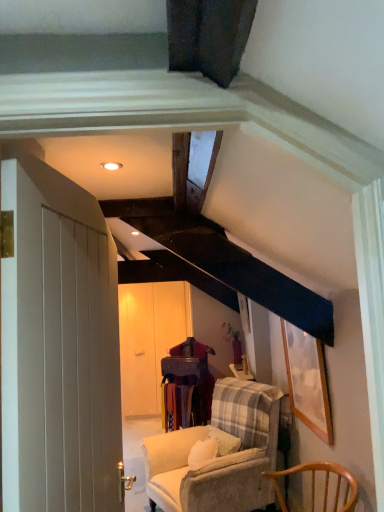
Question: Is there a large distance between wooden table at center and wooden picture frame at upper right?

Choices:
 (A) no
 (B) yes

Answer: (B)

Question: From a real-world perspective, is wooden table at center beneath wooden picture frame at upper right?

Choices:
 (A) no
 (B) yes

Answer: (B)

Question: Does wooden table at center have a greater height compared to wooden picture frame at upper right?

Choices:
 (A) yes
 (B) no

Answer: (A)

Question: From a real-world perspective, does wooden table at center stand above wooden picture frame at upper right?

Choices:
 (A) yes
 (B) no

Answer: (B)

Question: Would you say wooden table at center contains wooden picture frame at upper right?

Choices:
 (A) no
 (B) yes

Answer: (A)

Question: Is wooden table at center placed right next to wooden picture frame at upper right?

Choices:
 (A) no
 (B) yes

Answer: (A)

Question: Considering the relative sizes of wooden table at center and velvet beige armchair at center, which is counted as the first chair, starting from the back, in the image provided, is wooden table at center taller than velvet beige armchair at center, which is counted as the first chair, starting from the back,?

Choices:
 (A) no
 (B) yes

Answer: (A)

Question: From the image's perspective, is wooden table at center over velvet beige armchair at center, the second chair viewed from the front?

Choices:
 (A) yes
 (B) no

Answer: (A)

Question: Is velvet beige armchair at center, which is counted as the first chair, starting from the back, located within wooden table at center?

Choices:
 (A) no
 (B) yes

Answer: (A)

Question: From a real-world perspective, is wooden table at center physically above velvet beige armchair at center, which is counted as the first chair, starting from the back?

Choices:
 (A) no
 (B) yes

Answer: (B)

Question: Considering the relative positions of wooden table at center and velvet beige armchair at center, the second chair viewed from the front, in the image provided, is wooden table at center to the right of velvet beige armchair at center, the second chair viewed from the front, from the viewer's perspective?

Choices:
 (A) yes
 (B) no

Answer: (B)

Question: Is wooden table at center smaller than velvet beige armchair at center, the second chair viewed from the front?

Choices:
 (A) no
 (B) yes

Answer: (B)

Question: Is the position of velvet beige armchair at center, the second chair viewed from the front, less distant than that of white wooden door at left?

Choices:
 (A) yes
 (B) no

Answer: (B)